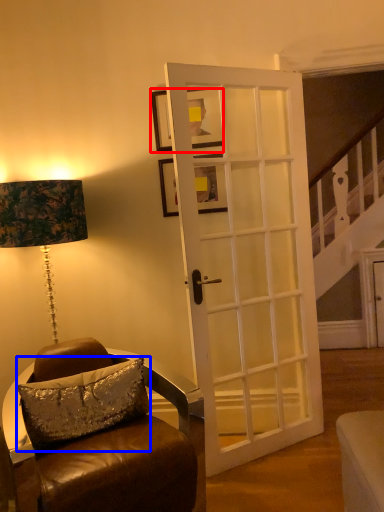
Question: Which object is further to the camera taking this photo, picture frame (highlighted by a red box) or pillow (highlighted by a blue box)?

Choices:
 (A) picture frame
 (B) pillow

Answer: (A)